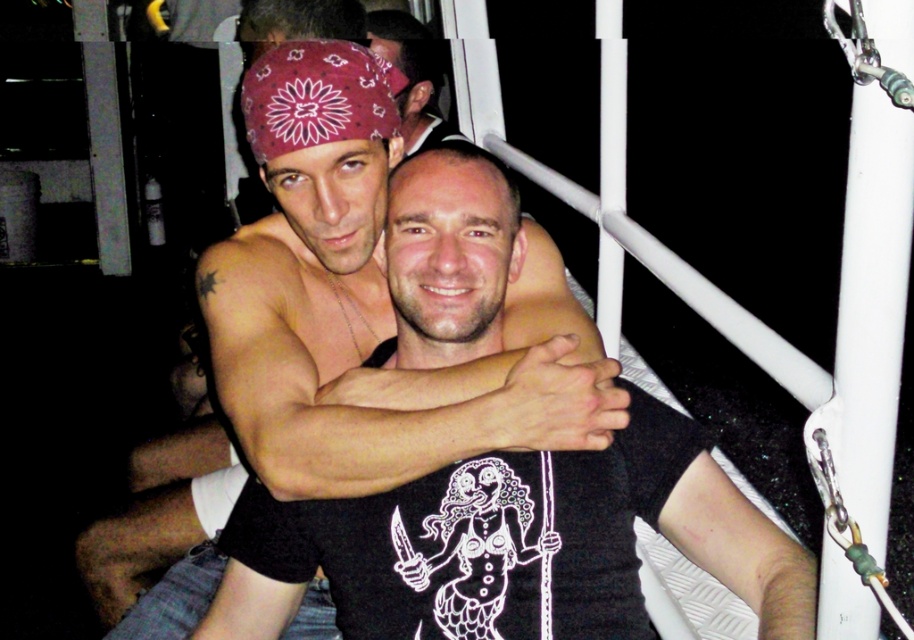
Question: Does matte black shirt at center come behind matte black bandana at upper center?

Choices:
 (A) no
 (B) yes

Answer: (A)

Question: Which of the following is the closest to the observer?

Choices:
 (A) matte black bandana at upper center
 (B) matte black shirt at center

Answer: (B)

Question: Does matte black shirt at center appear under matte black bandana at upper center?

Choices:
 (A) no
 (B) yes

Answer: (B)

Question: Is matte black shirt at center thinner than matte black bandana at upper center?

Choices:
 (A) no
 (B) yes

Answer: (A)